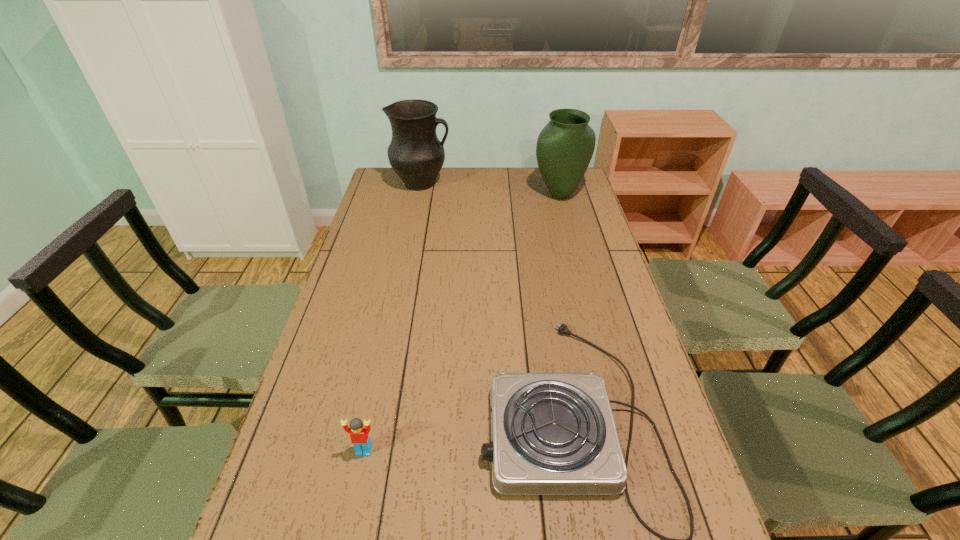
The width and height of the screenshot is (960, 540). What are the coordinates of `vacant space that's between the third tallest object and the vase` in the screenshot? It's located at click(x=462, y=322).

What are the coordinates of `empty space that is in between the pitcher and the vase` in the screenshot? It's located at (491, 189).

Where is `object identified as the third closest to the hotplate`? object identified as the third closest to the hotplate is located at coordinates (415, 153).

Where is `object that is the third closest one to the vase`? This screenshot has width=960, height=540. object that is the third closest one to the vase is located at coordinates (359, 431).

In order to click on free location that satisfies the following two spatial constraints: 1. on the handle side of the pitcher; 2. on the face of the Lego in this screenshot , I will do `click(368, 450)`.

At what (x,y) coordinates should I click in order to perform the action: click on free point that satisfies the following two spatial constraints: 1. on the handle side of the pitcher; 2. on the face of the Lego. Please return your answer as a coordinate pair (x, y). This screenshot has height=540, width=960. Looking at the image, I should click on (368, 450).

You are a GUI agent. You are given a task and a screenshot of the screen. Output one action in this format:
    pyautogui.click(x=<x>, y=<y>)
    Task: Click on the vacant space that satisfies the following two spatial constraints: 1. on the handle side of the pitcher; 2. on the face of the Lego
    The image size is (960, 540).
    Given the screenshot: What is the action you would take?
    pyautogui.click(x=368, y=450)